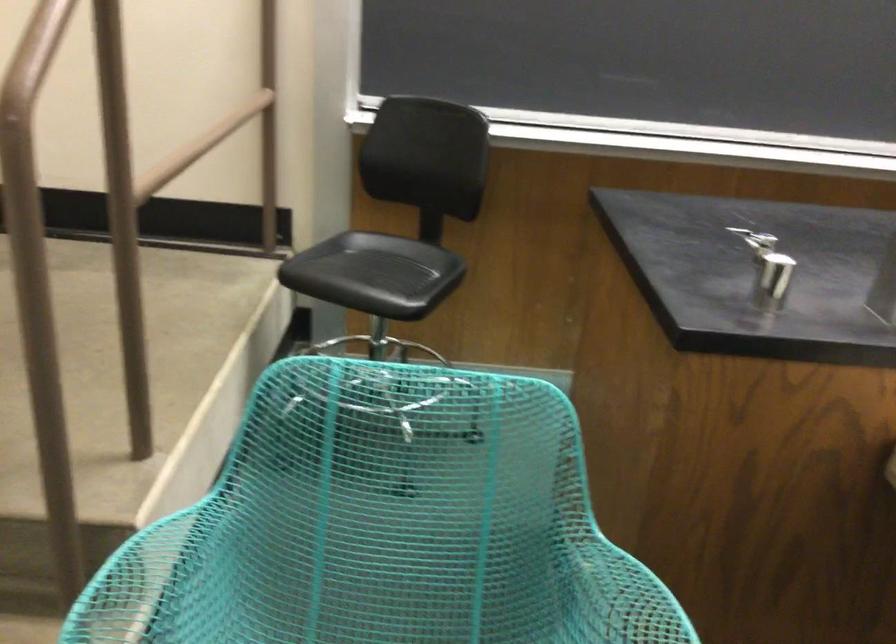
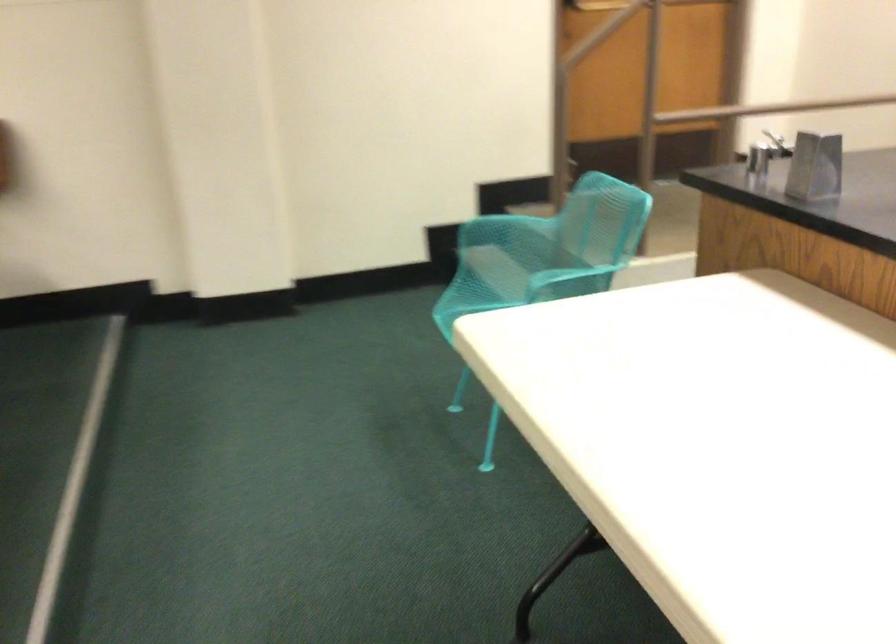
Question: I am providing you with two images of the same scene from different viewpoints. Please identify which objects are invisible in image2.

Choices:
 (A) metal lab clamp
 (B) turquoise chair armrest
 (C) faucet handle
 (D) onion bulb

Answer: (A)